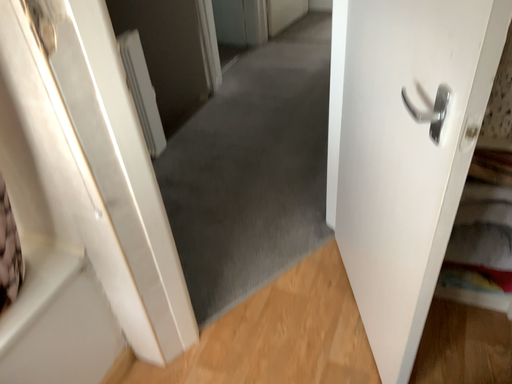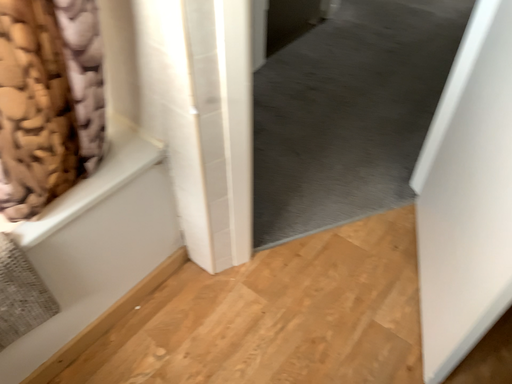
Question: How did the camera likely rotate when shooting the video?

Choices:
 (A) rotated left
 (B) rotated right

Answer: (A)